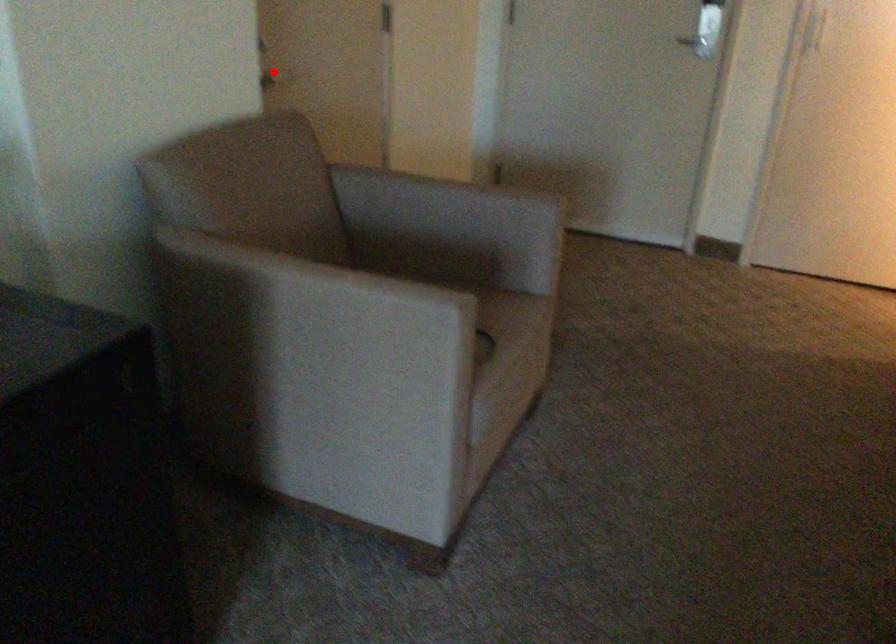
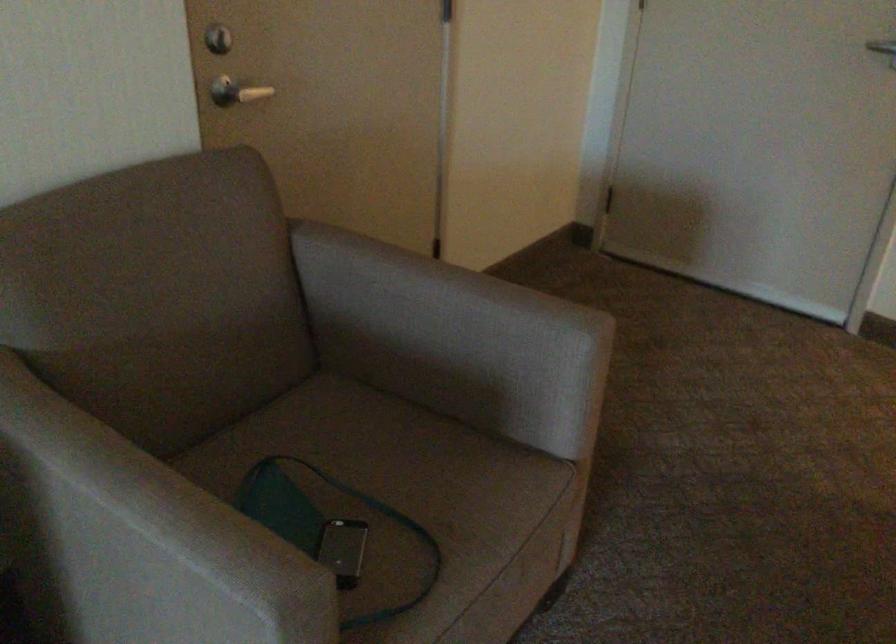
Question: I am providing you with two images of the same scene from different viewpoints. Image1 has a red point marked. In image2, the corresponding 3D location appears at what relative position? Reply with the corresponding letter.

Choices:
 (A) Closer
 (B) Farther

Answer: (A)